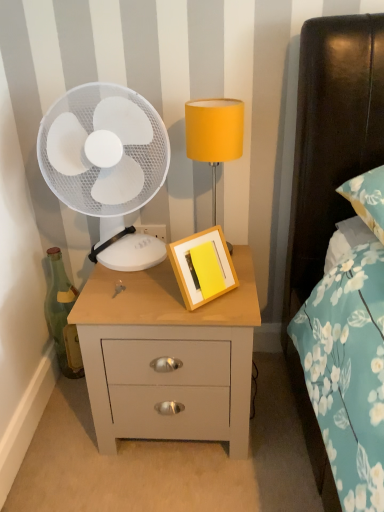
Question: In terms of height, does wooden picture frame at center look taller or shorter compared to green glass bottle at left?

Choices:
 (A) short
 (B) tall

Answer: (A)

Question: From the image's perspective, is wooden picture frame at center positioned above or below green glass bottle at left?

Choices:
 (A) above
 (B) below

Answer: (A)

Question: Estimate the real-world distances between objects in this image. Which object is closer to the yellow fabric lampshade at upper center?

Choices:
 (A) wooden picture frame at center
 (B) green glass bottle at left
 (C) white plastic fan at left
 (D) light wood/finish nightstand at center

Answer: (C)

Question: Estimate the real-world distances between objects in this image. Which object is farther from the white plastic fan at left?

Choices:
 (A) yellow fabric lampshade at upper center
 (B) light wood/finish nightstand at center
 (C) wooden picture frame at center
 (D) green glass bottle at left

Answer: (D)